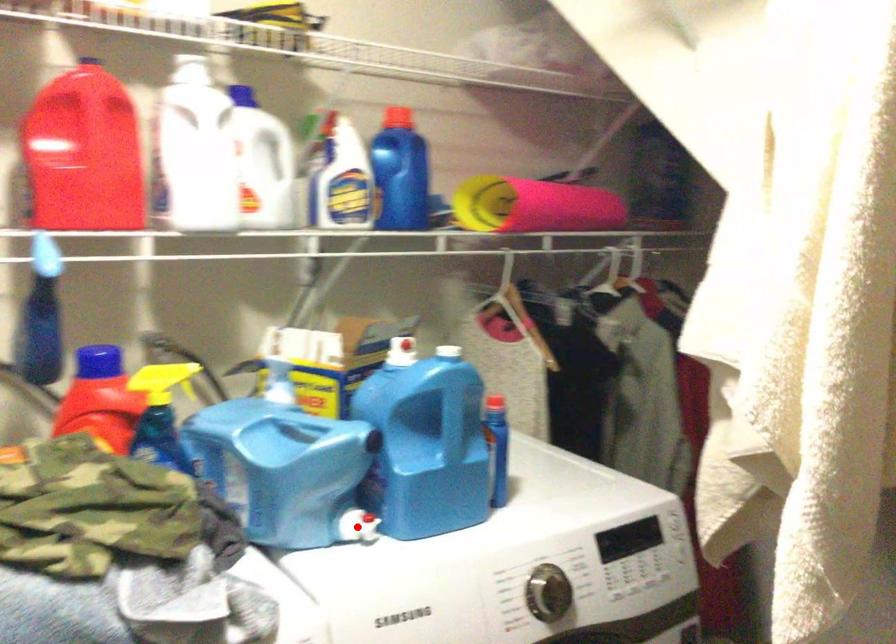
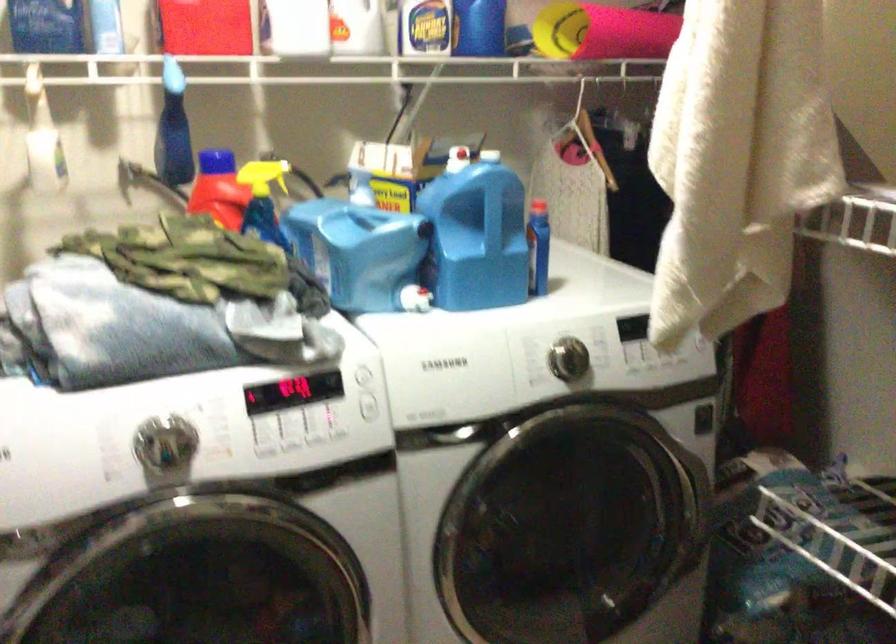
Question: A red point is marked in image1. In image2, is the corresponding 3D point closer to the camera or farther? Reply with the corresponding letter.

Choices:
 (A) The corresponding 3D point is closer.
 (B) The corresponding 3D point is farther.

Answer: (B)